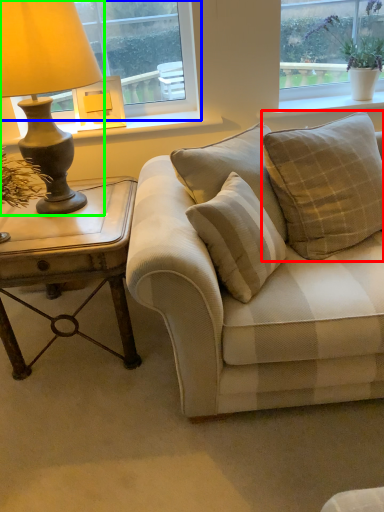
Question: Which is nearer to the pillow (highlighted by a red box)? window (highlighted by a blue box) or lamp (highlighted by a green box).

Choices:
 (A) window
 (B) lamp

Answer: (A)